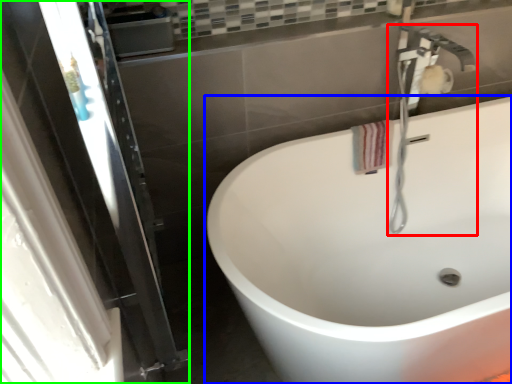
Question: Considering the real-world distances, which object is closest to plumbing fixture (highlighted by a red box)? bathtub (highlighted by a blue box) or screen door (highlighted by a green box).

Choices:
 (A) bathtub
 (B) screen door

Answer: (A)